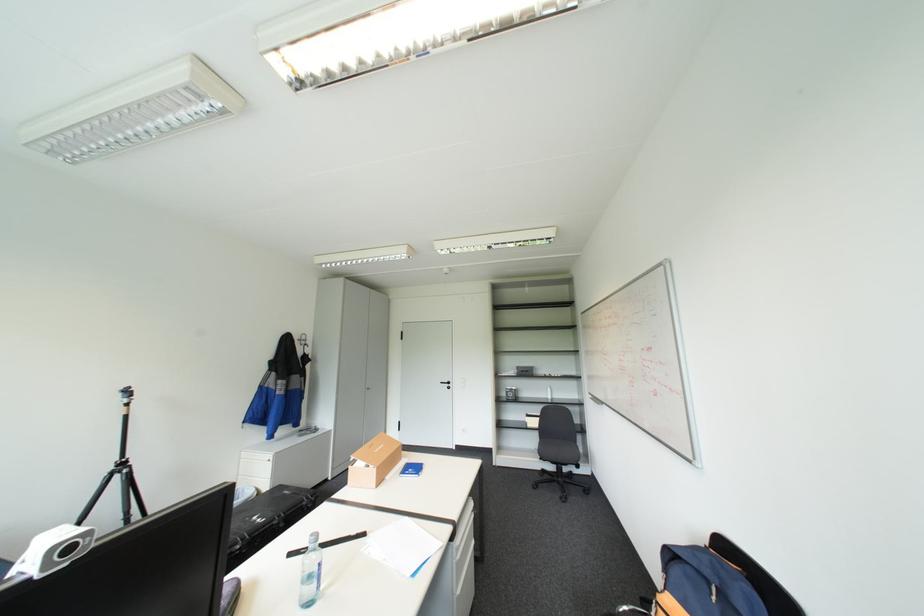
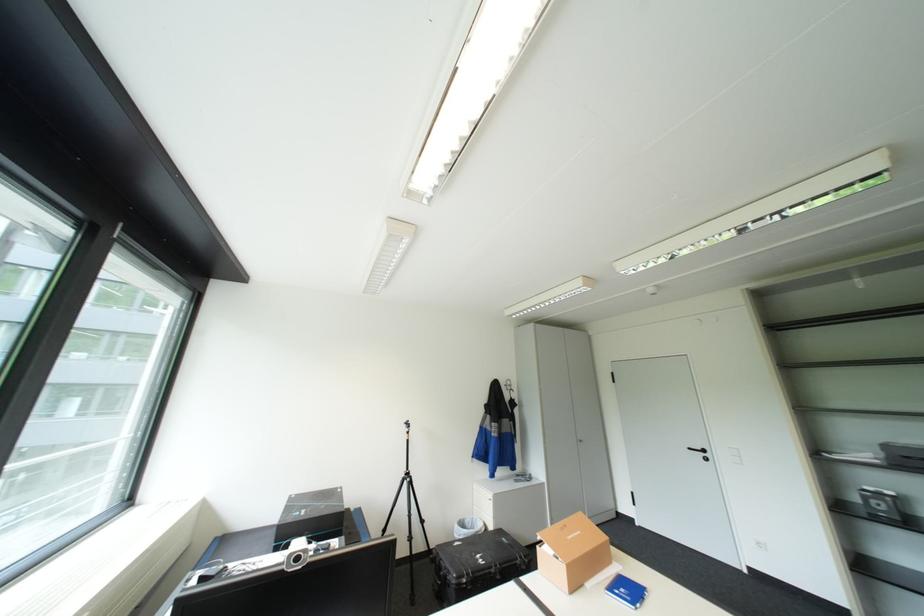
The point at [358,464] is marked in the first image. Where is the corresponding point in the second image?

(545, 545)